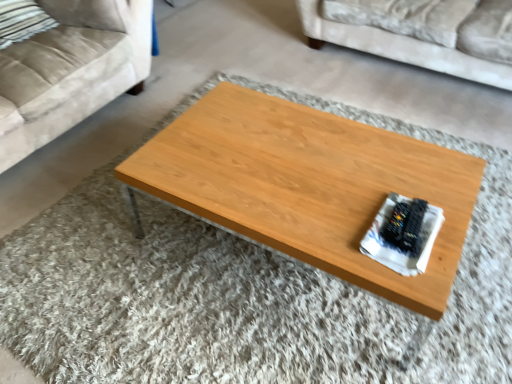
Question: Is beige fabric pillow at upper left, the first pillow viewed from the right, aimed at woodenmaterial/texturecoffee table at center?

Choices:
 (A) no
 (B) yes

Answer: (B)

Question: Considering the relative sizes of beige fabric pillow at upper left, the first pillow viewed from the right, and woodenmaterial/texturecoffee table at center in the image provided, is beige fabric pillow at upper left, the first pillow viewed from the right, smaller than woodenmaterial/texturecoffee table at center?

Choices:
 (A) no
 (B) yes

Answer: (B)

Question: From the image's perspective, is beige fabric pillow at upper left, which is counted as the second pillow, starting from the left, located above woodenmaterial/texturecoffee table at center?

Choices:
 (A) no
 (B) yes

Answer: (B)

Question: Is beige fabric pillow at upper left, which is counted as the second pillow, starting from the left, further to the viewer compared to woodenmaterial/texturecoffee table at center?

Choices:
 (A) no
 (B) yes

Answer: (B)

Question: Does beige fabric pillow at upper left, the first pillow viewed from the right, appear on the right side of woodenmaterial/texturecoffee table at center?

Choices:
 (A) yes
 (B) no

Answer: (B)

Question: Considering the positions of woodenmaterial/texturecoffee table at center and striped fabric pillow at upper left, arranged as the 1th pillow when viewed from the left, in the image, is woodenmaterial/texturecoffee table at center wider or thinner than striped fabric pillow at upper left, arranged as the 1th pillow when viewed from the left,?

Choices:
 (A) thin
 (B) wide

Answer: (B)

Question: From a real-world perspective, relative to striped fabric pillow at upper left, which ranks as the second pillow in right-to-left order, is woodenmaterial/texturecoffee table at center vertically above or below?

Choices:
 (A) above
 (B) below

Answer: (B)

Question: Considering their positions, is woodenmaterial/texturecoffee table at center located in front of or behind striped fabric pillow at upper left, which ranks as the second pillow in right-to-left order?

Choices:
 (A) front
 (B) behind

Answer: (A)

Question: Considering the positions of woodenmaterial/texturecoffee table at center and striped fabric pillow at upper left, arranged as the 1th pillow when viewed from the left, in the image, is woodenmaterial/texturecoffee table at center bigger or smaller than striped fabric pillow at upper left, arranged as the 1th pillow when viewed from the left,?

Choices:
 (A) big
 (B) small

Answer: (A)

Question: Is velvet beige couch at upper right, the second studio couch when ordered from left to right, inside or outside of suede beige couch at upper left, which appears as the 2th studio couch when viewed from the right?

Choices:
 (A) outside
 (B) inside

Answer: (A)

Question: In the image, is velvet beige couch at upper right, the second studio couch when ordered from left to right, on the left side or the right side of suede beige couch at upper left, which appears as the 1th studio couch when viewed from the left?

Choices:
 (A) right
 (B) left

Answer: (A)

Question: Relative to suede beige couch at upper left, which appears as the 1th studio couch when viewed from the left, is velvet beige couch at upper right, the second studio couch when ordered from left to right, in front or behind?

Choices:
 (A) behind
 (B) front

Answer: (A)

Question: From the image's perspective, relative to suede beige couch at upper left, which appears as the 2th studio couch when viewed from the right, is velvet beige couch at upper right, which is the first studio couch in right-to-left order, above or below?

Choices:
 (A) below
 (B) above

Answer: (B)

Question: From the image's perspective, is woodenmaterial/texturecoffee table at center located above or below beige fabric pillow at upper left, which is counted as the second pillow, starting from the left?

Choices:
 (A) below
 (B) above

Answer: (A)

Question: Considering the positions of woodenmaterial/texturecoffee table at center and beige fabric pillow at upper left, the first pillow viewed from the right, in the image, is woodenmaterial/texturecoffee table at center taller or shorter than beige fabric pillow at upper left, the first pillow viewed from the right,?

Choices:
 (A) short
 (B) tall

Answer: (B)